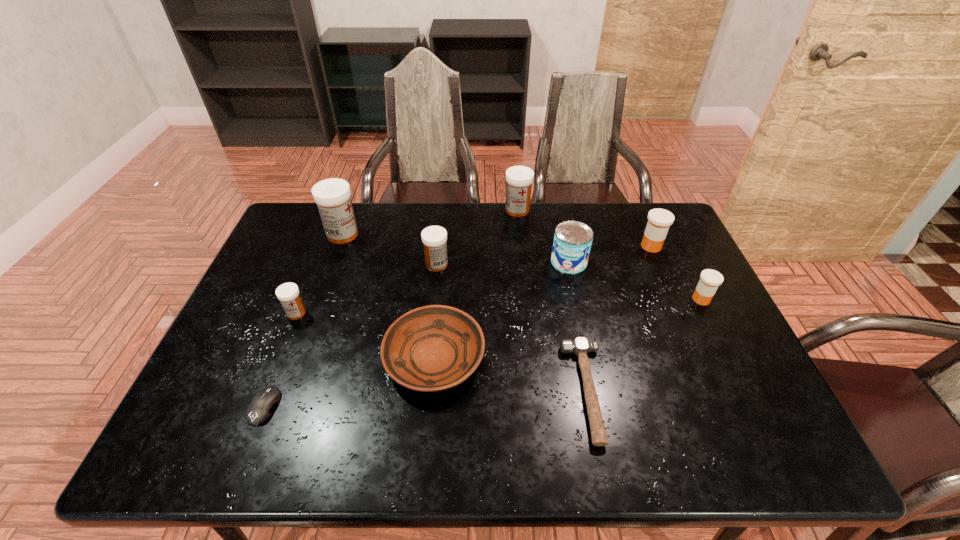
You are a GUI agent. You are given a task and a screenshot of the screen. Output one action in this format:
    pyautogui.click(x=<x>, y=<y>)
    Task: Click on the free space located 0.060m on the striking face of the hammer
    
    Given the screenshot: What is the action you would take?
    pyautogui.click(x=541, y=392)

Image resolution: width=960 pixels, height=540 pixels. I want to click on vacant position located on the left of the black computer equipment, so click(229, 406).

Identify the location of hammer that is at the near edge. (580, 346).

Image resolution: width=960 pixels, height=540 pixels. Find the location of `computer equipment that is positioned at the near edge`. computer equipment that is positioned at the near edge is located at coordinates (260, 408).

Where is `computer equipment at the left edge`? computer equipment at the left edge is located at coordinates (260, 408).

The height and width of the screenshot is (540, 960). I want to click on object that is at the far left corner, so click(333, 196).

Locate an element on the screen. object present at the near left corner is located at coordinates (260, 408).

The image size is (960, 540). I want to click on object that is at the far right corner, so click(x=659, y=220).

Locate an element on the screen. The width and height of the screenshot is (960, 540). vacant area at the far edge of the desktop is located at coordinates (618, 230).

In the image, there is a desktop. Identify the location of vacant space at the left edge. (233, 388).